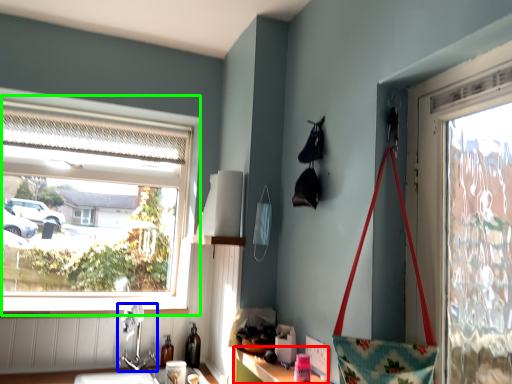
Question: Which object is the farthest from cabinetry (highlighted by a red box)? Choose among these: faucet (highlighted by a blue box) or window (highlighted by a green box).

Choices:
 (A) faucet
 (B) window

Answer: (B)